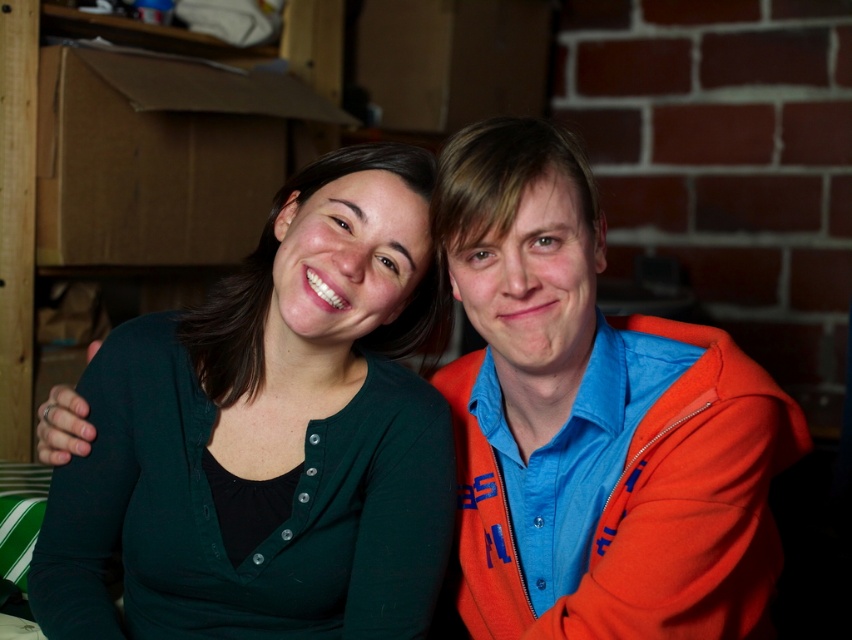
Who is more distant from viewer, (144, 529) or (636, 451)?

The point (144, 529) is behind.

Locate an element on the screen. This screenshot has height=640, width=852. green matte cardigan at center is located at coordinates (269, 435).